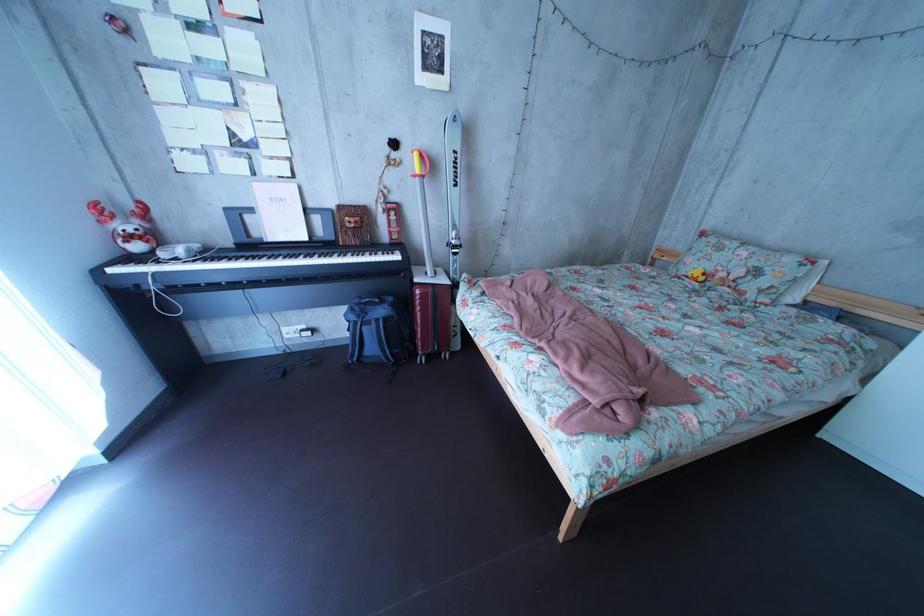
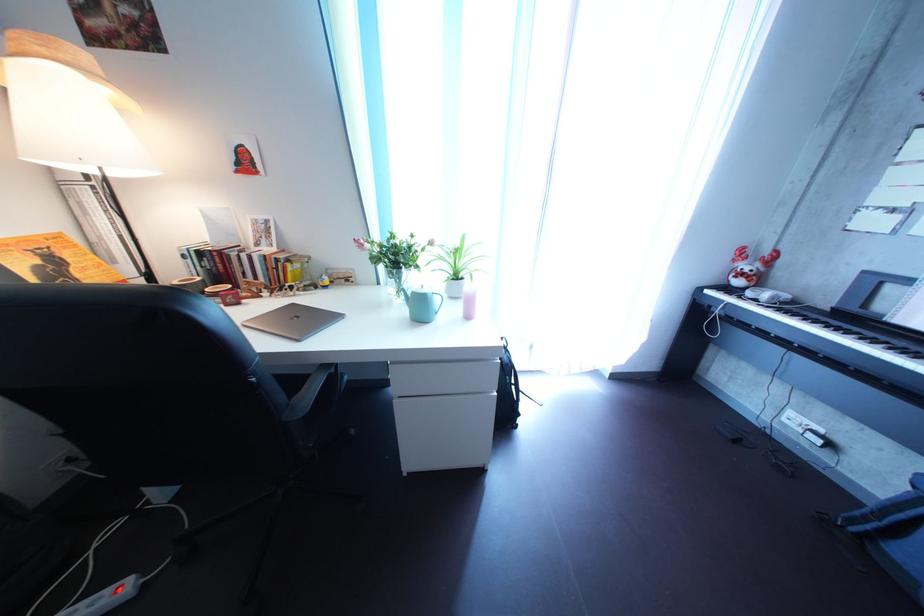
The images are taken continuously from a first-person perspective. In which direction is your viewpoint rotating?

The rotation direction of the camera is left-down.